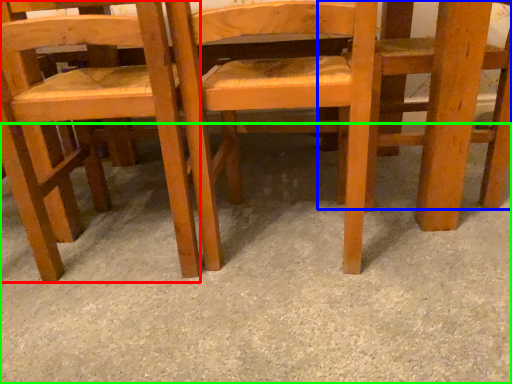
Question: Based on their relative distances, which object is farther from chair (highlighted by a red box)? Choose from chair (highlighted by a blue box) and concrete (highlighted by a green box).

Choices:
 (A) chair
 (B) concrete

Answer: (A)